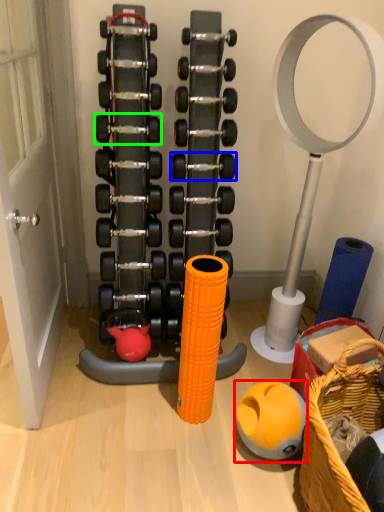
Question: Considering the real-world distances, which object is closest to ball (highlighted by a red box)? dumbbell (highlighted by a blue box) or dumbbell (highlighted by a green box).

Choices:
 (A) dumbbell
 (B) dumbbell

Answer: (A)